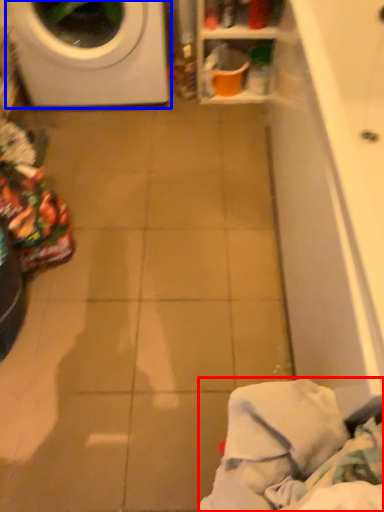
Question: Which object is further to the camera taking this photo, clothing (highlighted by a red box) or washing machine (highlighted by a blue box)?

Choices:
 (A) clothing
 (B) washing machine

Answer: (B)